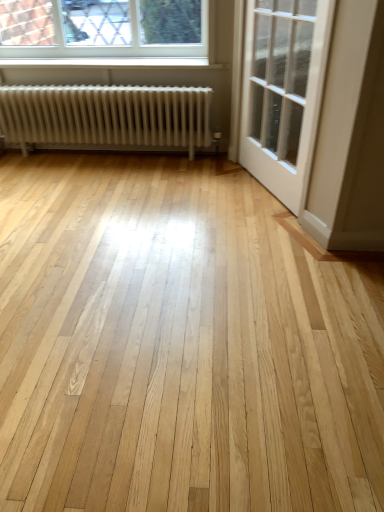
Question: Is white matte radiator at left beside white glossy door at upper right?

Choices:
 (A) yes
 (B) no

Answer: (B)

Question: From a real-world perspective, is white matte radiator at left on white glossy door at upper right?

Choices:
 (A) yes
 (B) no

Answer: (B)

Question: Does white matte radiator at left contain white glossy door at upper right?

Choices:
 (A) yes
 (B) no

Answer: (B)

Question: Would you consider white matte radiator at left to be distant from white glossy door at upper right?

Choices:
 (A) yes
 (B) no

Answer: (B)

Question: Is the position of white matte radiator at left less distant than that of white glossy door at upper right?

Choices:
 (A) no
 (B) yes

Answer: (A)

Question: Is white matte radiator at left smaller than white glossy door at upper right?

Choices:
 (A) yes
 (B) no

Answer: (B)

Question: From the image's perspective, is clear glass window at upper left on white matte radiator at left?

Choices:
 (A) no
 (B) yes

Answer: (B)

Question: Is the position of clear glass window at upper left less distant than that of white matte radiator at left?

Choices:
 (A) no
 (B) yes

Answer: (A)

Question: From a real-world perspective, does clear glass window at upper left stand above white matte radiator at left?

Choices:
 (A) no
 (B) yes

Answer: (B)

Question: Can you confirm if clear glass window at upper left is taller than white matte radiator at left?

Choices:
 (A) no
 (B) yes

Answer: (A)

Question: Is clear glass window at upper left outside white matte radiator at left?

Choices:
 (A) yes
 (B) no

Answer: (A)

Question: From the image's perspective, is clear glass window at upper left below white matte radiator at left?

Choices:
 (A) yes
 (B) no

Answer: (B)

Question: From a real-world perspective, is clear glass window at upper left located higher than white glossy door at upper right?

Choices:
 (A) no
 (B) yes

Answer: (B)